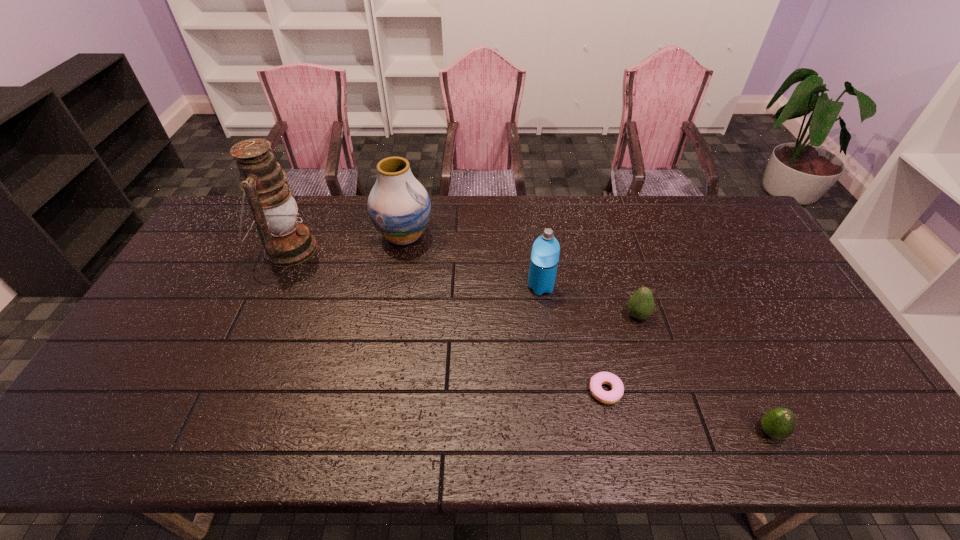
You are a GUI agent. You are given a task and a screenshot of the screen. Output one action in this format:
    pyautogui.click(x=<x>, y=<y>)
    Task: Click on the free space between the shortest object and the nearest object
    This screenshot has width=960, height=540.
    Given the screenshot: What is the action you would take?
    pyautogui.click(x=688, y=411)

This screenshot has height=540, width=960. Find the location of `free point between the fourth object from right to left and the vase`. free point between the fourth object from right to left and the vase is located at coordinates (472, 261).

The width and height of the screenshot is (960, 540). I want to click on unoccupied area between the vase and the left avocado, so click(x=520, y=276).

At what (x,y) coordinates should I click in order to perform the action: click on free space between the shortest object and the nearest object. Please return your answer as a coordinate pair (x, y). The width and height of the screenshot is (960, 540). Looking at the image, I should click on (688, 411).

Find the location of `free space between the second nearest object and the vase`. free space between the second nearest object and the vase is located at coordinates tap(505, 313).

In order to click on free space between the fifth farthest object and the third object from left to right in this screenshot , I will do `click(573, 339)`.

Locate an element on the screen. Image resolution: width=960 pixels, height=540 pixels. the closest object relative to the thermos bottle is located at coordinates (641, 304).

Select which object appears as the second closest to the vase. Please provide its 2D coordinates. Your answer should be formatted as a tuple, i.e. [(x, y)], where the tuple contains the x and y coordinates of a point satisfying the conditions above.

[(545, 252)]

Locate an element on the screen. The image size is (960, 540). blank space that satisfies the following two spatial constraints: 1. on the front side of the shorter avocado; 2. on the left side of the second object from left to right is located at coordinates (369, 432).

You are a GUI agent. You are given a task and a screenshot of the screen. Output one action in this format:
    pyautogui.click(x=<x>, y=<y>)
    Task: Click on the free region that satisfies the following two spatial constraints: 1. on the front side of the nearer avocado; 2. on the left side of the fourth farthest object
    This screenshot has width=960, height=540.
    Given the screenshot: What is the action you would take?
    pyautogui.click(x=674, y=432)